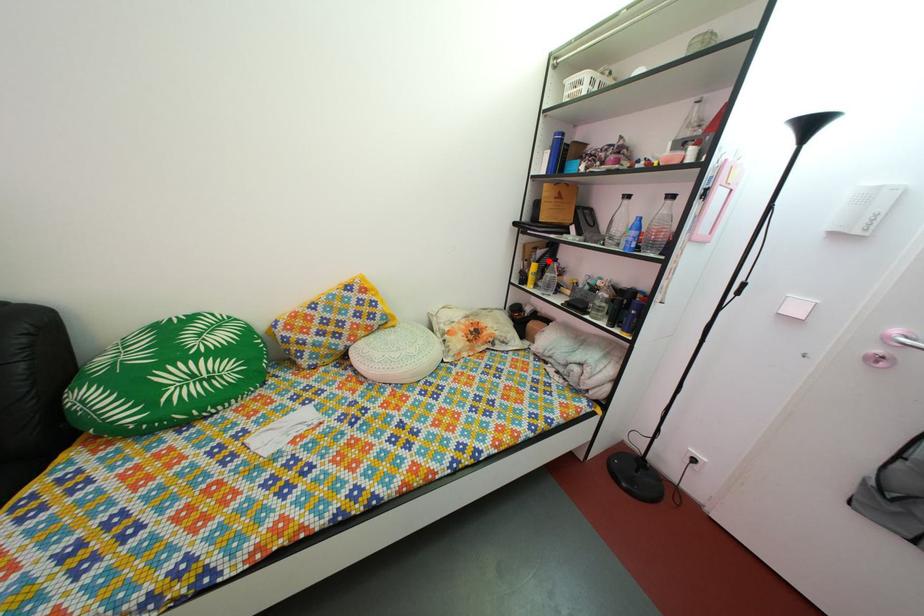
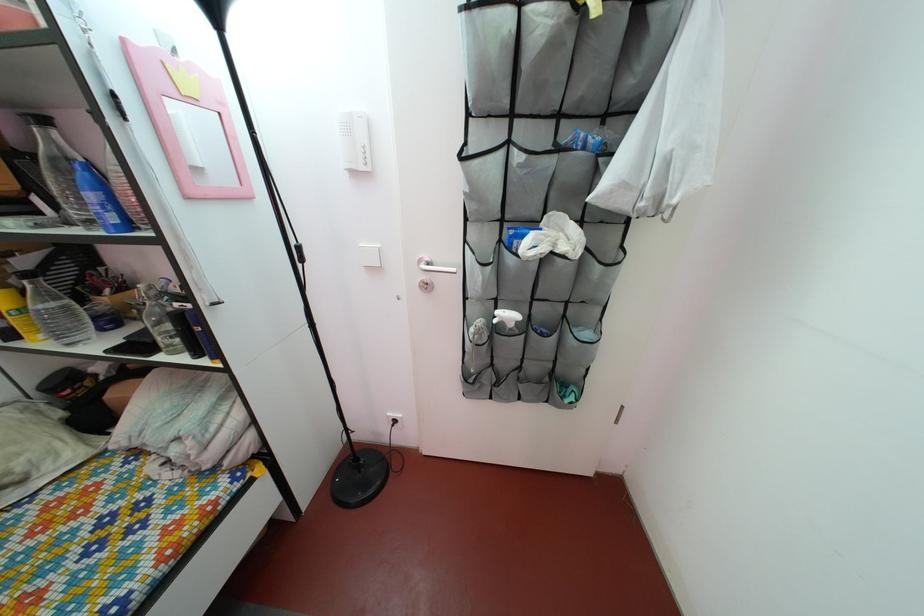
Question: I am providing you with two images of the same scene from different viewpoints. Image1 has a red point marked. In image2, the corresponding 3D location appears at what relative position? Reply with the corresponding letter.

Choices:
 (A) Closer
 (B) Farther

Answer: (B)